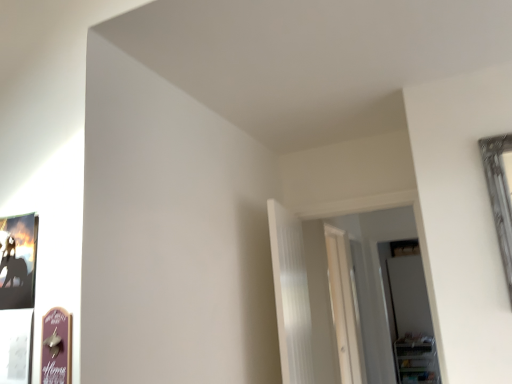
What do you see at coordinates (291, 295) in the screenshot? Image resolution: width=512 pixels, height=384 pixels. I see `white ribbed curtain at center` at bounding box center [291, 295].

This screenshot has width=512, height=384. Identify the location of white ribbed curtain at center. (291, 295).

What is the approximate width of clear plastic shelf at lower right?

clear plastic shelf at lower right is 21.51 inches in width.

Where is `transparent glass door at right, which ranks as the 2th glass door in left-to-right order`? The image size is (512, 384). transparent glass door at right, which ranks as the 2th glass door in left-to-right order is located at coordinates (412, 322).

The image size is (512, 384). What do you see at coordinates (412, 322) in the screenshot?
I see `transparent glass door at right, which ranks as the 2th glass door in left-to-right order` at bounding box center [412, 322].

Identify the location of white ribbed curtain at center. coord(291,295).

Is transparent glass door at right, which ranks as the 2th glass door in left-to-right order, positioned with its back to transparent glass door at center, which ranks as the 2th glass door in back-to-front order?

No, transparent glass door at right, which ranks as the 2th glass door in left-to-right order, is not facing away from transparent glass door at center, which ranks as the 2th glass door in back-to-front order.

Is transparent glass door at right, the second glass door when ordered from front to back, closer to the viewer compared to transparent glass door at center, which is the 1th glass door from front to back?

That is False.

Are transparent glass door at right, which ranks as the 2th glass door in left-to-right order, and transparent glass door at center, which is the 1th glass door from front to back, making contact?

No, transparent glass door at right, which ranks as the 2th glass door in left-to-right order, is not making contact with transparent glass door at center, which is the 1th glass door from front to back.

Considering the relative positions of transparent glass door at right, which is the 1th glass door from right to left, and transparent glass door at center, which is the 1th glass door from front to back, in the image provided, is transparent glass door at right, which is the 1th glass door from right to left, to the left or to the right of transparent glass door at center, which is the 1th glass door from front to back,?

In the image, transparent glass door at right, which is the 1th glass door from right to left, appears on the right side of transparent glass door at center, which is the 1th glass door from front to back.

In order to click on picture frame that appears on the left of white ribbed curtain at center in this screenshot , I will do `click(56, 347)`.

Does wooden sign at lower left have a smaller size compared to white ribbed curtain at center?

Indeed, wooden sign at lower left has a smaller size compared to white ribbed curtain at center.

From a real-world perspective, does wooden sign at lower left sit lower than white ribbed curtain at center?

Yes, from a real-world perspective, wooden sign at lower left is beneath white ribbed curtain at center.

Is wooden sign at lower left facing away from white ribbed curtain at center?

Yes, wooden sign at lower left is positioned with its back facing white ribbed curtain at center.

Could you tell me if white ribbed curtain at center is turned towards wooden sign at lower left?

No, white ribbed curtain at center is not facing towards wooden sign at lower left.

Considering the relative positions of white ribbed curtain at center and wooden sign at lower left in the image provided, is white ribbed curtain at center to the left of wooden sign at lower left from the viewer's perspective?

Incorrect, white ribbed curtain at center is not on the left side of wooden sign at lower left.

Considering the sizes of objects white ribbed curtain at center and wooden sign at lower left in the image provided, who is thinner, white ribbed curtain at center or wooden sign at lower left?

Thinner between the two is wooden sign at lower left.

From the image's perspective, would you say white ribbed curtain at center is positioned over wooden sign at lower left?

Incorrect, from the image's perspective, white ribbed curtain at center is lower than wooden sign at lower left.

Can you see clear plastic shelf at lower right touching white ribbed curtain at center?

They are not placed beside each other.

Does clear plastic shelf at lower right have a greater width compared to white ribbed curtain at center?

Yes.

Considering the relative positions of clear plastic shelf at lower right and white ribbed curtain at center in the image provided, is clear plastic shelf at lower right to the left or to the right of white ribbed curtain at center?

Clearly, clear plastic shelf at lower right is on the right of white ribbed curtain at center in the image.

From the image's perspective, which object appears higher, wooden sign at lower left or transparent glass door at right, the second glass door when ordered from front to back?

wooden sign at lower left appears higher in the image.

Measure the distance from wooden sign at lower left to transparent glass door at right, which ranks as the 2th glass door in left-to-right order.

wooden sign at lower left is 5.51 meters from transparent glass door at right, which ranks as the 2th glass door in left-to-right order.

How many degrees apart are the facing directions of wooden sign at lower left and transparent glass door at right, the 1th glass door from the back?

There is a 1.76-degree angle between the facing directions of wooden sign at lower left and transparent glass door at right, the 1th glass door from the back.

Considering the sizes of objects wooden sign at lower left and transparent glass door at right, which is the 1th glass door from right to left, in the image provided, who is bigger, wooden sign at lower left or transparent glass door at right, which is the 1th glass door from right to left,?

Bigger between the two is transparent glass door at right, which is the 1th glass door from right to left.

Does point (422, 321) appear closer or farther from the camera than point (45, 347)?

Point (422, 321) is farther from the camera than point (45, 347).

In the image, is transparent glass door at right, the second glass door when ordered from front to back, positioned in front of or behind wooden sign at lower left?

Visually, transparent glass door at right, the second glass door when ordered from front to back, is located behind wooden sign at lower left.

Considering the sizes of objects transparent glass door at right, which is the 1th glass door from right to left, and wooden sign at lower left in the image provided, who is taller, transparent glass door at right, which is the 1th glass door from right to left, or wooden sign at lower left?

Standing taller between the two is transparent glass door at right, which is the 1th glass door from right to left.

Is transparent glass door at right, which ranks as the 2th glass door in left-to-right order, smaller than wooden sign at lower left?

No.

Where is `glass door above the transparent glass door at right, which ranks as the 2th glass door in left-to-right order (from the image's perspective)`? glass door above the transparent glass door at right, which ranks as the 2th glass door in left-to-right order (from the image's perspective) is located at coordinates (344, 307).

In terms of width, does transparent glass door at center, which is counted as the 1th glass door, starting from the left, look wider or thinner when compared to transparent glass door at right, which ranks as the 2th glass door in left-to-right order?

Clearly, transparent glass door at center, which is counted as the 1th glass door, starting from the left, has less width compared to transparent glass door at right, which ranks as the 2th glass door in left-to-right order.

Is transparent glass door at right, which is the 1th glass door from right to left, a part of transparent glass door at center, which is the 1th glass door from front to back?

No, transparent glass door at right, which is the 1th glass door from right to left, is not inside transparent glass door at center, which is the 1th glass door from front to back.

Between transparent glass door at center, which ranks as the 2th glass door in back-to-front order, and transparent glass door at right, which ranks as the 2th glass door in left-to-right order, which one has smaller size?

transparent glass door at right, which ranks as the 2th glass door in left-to-right order.

This screenshot has width=512, height=384. What are the coordinates of `glass door that is in front of the transparent glass door at right, which ranks as the 2th glass door in left-to-right order` in the screenshot? It's located at (344, 307).

I want to click on curtain that appears below the wooden sign at lower left (from the image's perspective), so coord(291,295).

When comparing their distances from transparent glass door at right, the second glass door when ordered from front to back, does clear plastic shelf at lower right or transparent glass door at center, which is counted as the 1th glass door, starting from the left, seem further?

The object further to transparent glass door at right, the second glass door when ordered from front to back, is transparent glass door at center, which is counted as the 1th glass door, starting from the left.

Looking at the image, which one is located closer to wooden sign at lower left, transparent glass door at right, which ranks as the 2th glass door in left-to-right order, or clear plastic shelf at lower right?

clear plastic shelf at lower right is closer to wooden sign at lower left.

Consider the image. From the image, which object appears to be farther from transparent glass door at right, which is the 1th glass door from right to left, transparent glass door at center, which is counted as the 1th glass door, starting from the left, or wooden sign at lower left?

wooden sign at lower left lies further to transparent glass door at right, which is the 1th glass door from right to left, than the other object.

Which object lies nearer to the anchor point transparent glass door at right, which ranks as the 2th glass door in left-to-right order, wooden sign at lower left or clear plastic shelf at lower right?

The object closer to transparent glass door at right, which ranks as the 2th glass door in left-to-right order, is clear plastic shelf at lower right.

Estimate the real-world distances between objects in this image. Which object is closer to transparent glass door at center, which appears as the second glass door when viewed from the right, wooden sign at lower left or transparent glass door at right, the second glass door when ordered from front to back?

The object closer to transparent glass door at center, which appears as the second glass door when viewed from the right, is transparent glass door at right, the second glass door when ordered from front to back.

From the image, which object appears to be nearer to white ribbed curtain at center, clear plastic shelf at lower right or wooden sign at lower left?

wooden sign at lower left is closer to white ribbed curtain at center.

Estimate the real-world distances between objects in this image. Which object is further from white ribbed curtain at center, transparent glass door at right, which ranks as the 2th glass door in left-to-right order, or wooden sign at lower left?

transparent glass door at right, which ranks as the 2th glass door in left-to-right order, is further to white ribbed curtain at center.

Based on their spatial positions, is wooden sign at lower left or transparent glass door at center, which is the 1th glass door from front to back, closer to white ribbed curtain at center?

Among the two, wooden sign at lower left is located nearer to white ribbed curtain at center.

This screenshot has width=512, height=384. What are the coordinates of `curtain located between wooden sign at lower left and transparent glass door at right, the second glass door when ordered from front to back, in the depth direction` in the screenshot? It's located at (291, 295).

I want to click on glass door between transparent glass door at center, which is counted as the 1th glass door, starting from the left, and clear plastic shelf at lower right, along the z-axis, so point(412,322).

Image resolution: width=512 pixels, height=384 pixels. In order to click on glass door positioned between white ribbed curtain at center and transparent glass door at right, which is the 1th glass door from right to left, from near to far in this screenshot , I will do (344, 307).

Locate an element on the screen. Image resolution: width=512 pixels, height=384 pixels. curtain between wooden sign at lower left and clear plastic shelf at lower right in the front-back direction is located at coordinates (291, 295).